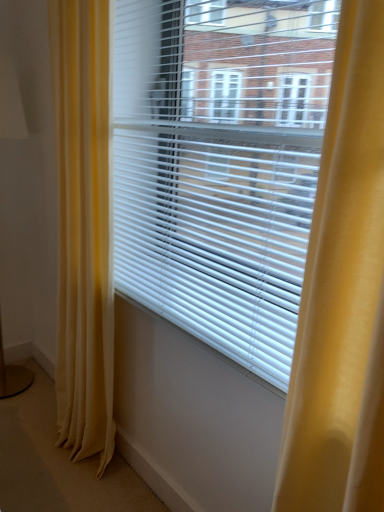
Question: From the image's perspective, is silky yellow curtain at left under white plastic blinds at center?

Choices:
 (A) yes
 (B) no

Answer: (A)

Question: Does silky yellow curtain at left appear on the left side of white plastic blinds at center?

Choices:
 (A) yes
 (B) no

Answer: (A)

Question: Does silky yellow curtain at left turn towards white plastic blinds at center?

Choices:
 (A) no
 (B) yes

Answer: (A)

Question: Can you confirm if silky yellow curtain at left is taller than white plastic blinds at center?

Choices:
 (A) yes
 (B) no

Answer: (A)

Question: Does silky yellow curtain at left have a smaller size compared to white plastic blinds at center?

Choices:
 (A) yes
 (B) no

Answer: (B)

Question: Considering the relative sizes of silky yellow curtain at left and white plastic blinds at center in the image provided, is silky yellow curtain at left thinner than white plastic blinds at center?

Choices:
 (A) yes
 (B) no

Answer: (B)

Question: Does silky yellow curtain at left have a greater width compared to matte gold table lamp at left?

Choices:
 (A) no
 (B) yes

Answer: (A)

Question: From the image's perspective, would you say silky yellow curtain at left is positioned over matte gold table lamp at left?

Choices:
 (A) yes
 (B) no

Answer: (B)

Question: Could matte gold table lamp at left be considered to be inside silky yellow curtain at left?

Choices:
 (A) no
 (B) yes

Answer: (A)

Question: Is silky yellow curtain at left closer to the viewer compared to matte gold table lamp at left?

Choices:
 (A) no
 (B) yes

Answer: (B)

Question: Is silky yellow curtain at left turned away from matte gold table lamp at left?

Choices:
 (A) yes
 (B) no

Answer: (B)

Question: From the image's perspective, is silky yellow curtain at left beneath matte gold table lamp at left?

Choices:
 (A) yes
 (B) no

Answer: (A)

Question: Can you confirm if white plastic blinds at center is shorter than silky yellow curtain at left?

Choices:
 (A) no
 (B) yes

Answer: (B)